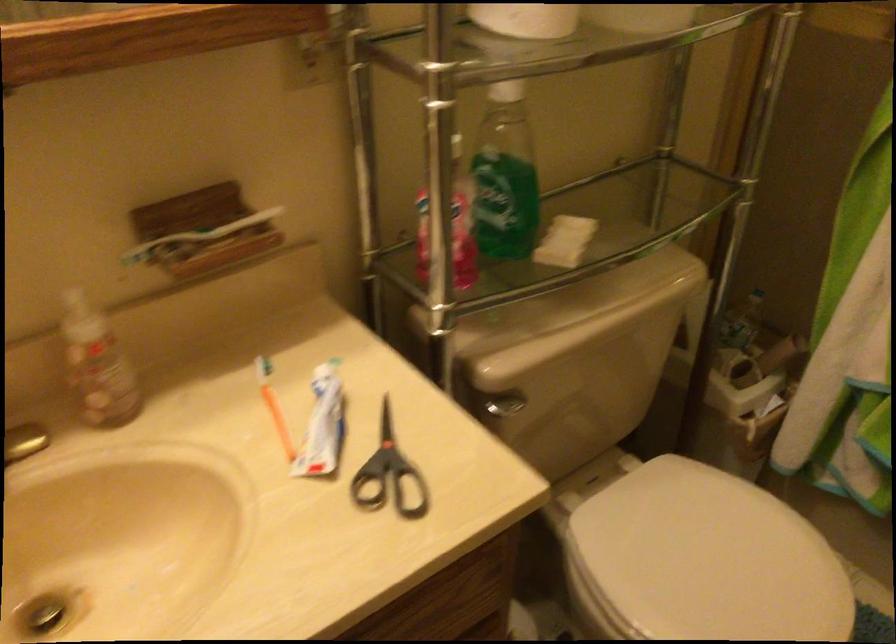
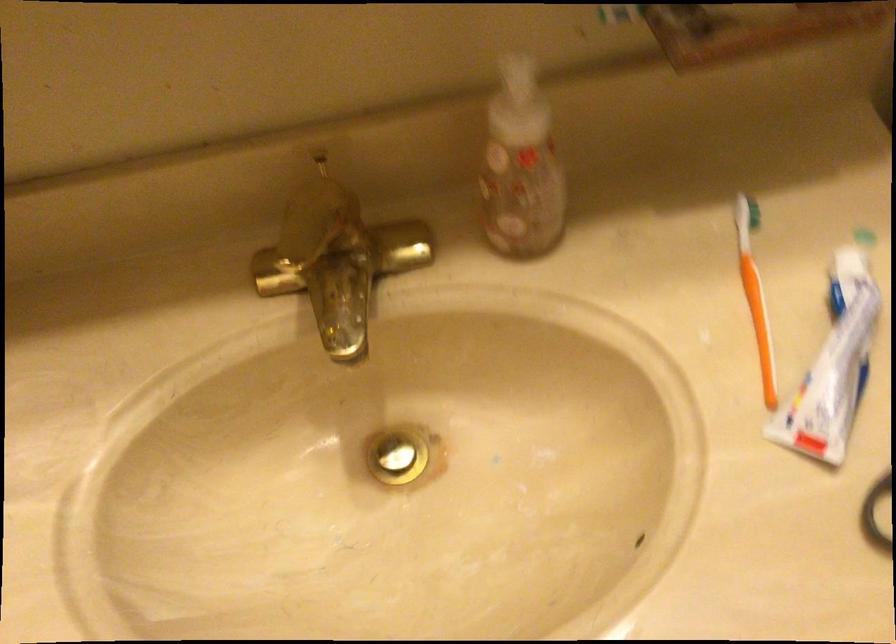
First-person continuous shooting, in which direction is the camera rotating?

The rotation direction of the camera is left-down.